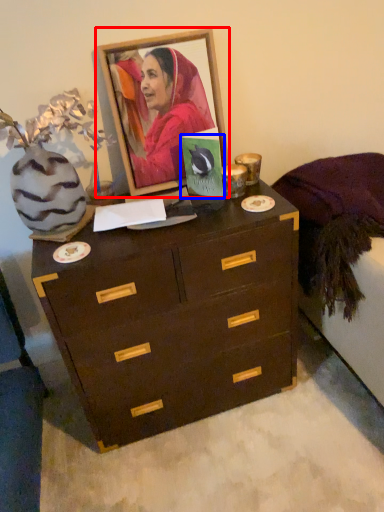
Question: Which object is closer to the camera taking this photo, picture frame (highlighted by a red box) or postcard (highlighted by a blue box)?

Choices:
 (A) picture frame
 (B) postcard

Answer: (A)